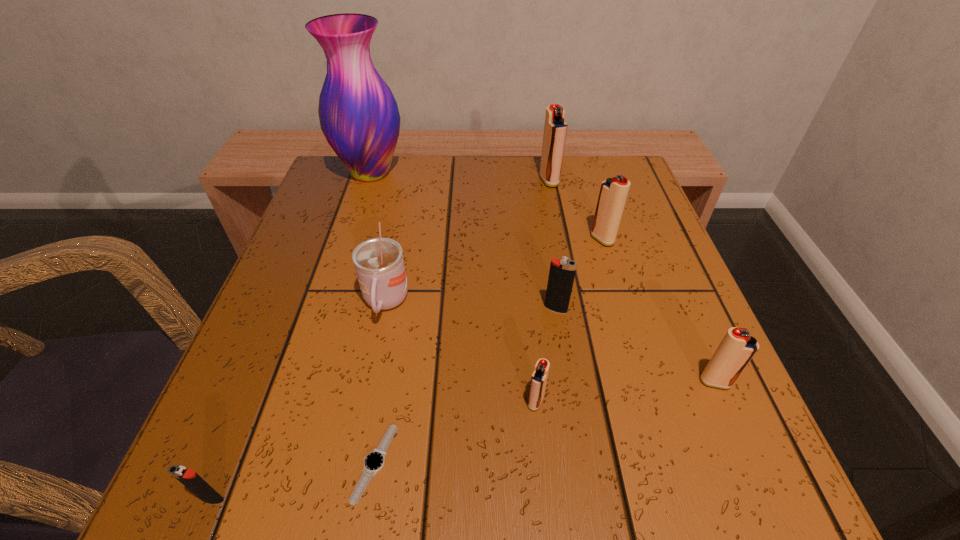
The width and height of the screenshot is (960, 540). I want to click on empty space between the fifth object from right to left and the watch, so click(455, 433).

Where is `free space between the fifth igniter from left to right and the left black igniter`? The height and width of the screenshot is (540, 960). free space between the fifth igniter from left to right and the left black igniter is located at coordinates [407, 369].

Identify the location of free area in between the cup and the smaller black igniter. (299, 401).

The image size is (960, 540). In order to click on unoccupied area between the cup and the nearest igniter in this screenshot , I will do `click(299, 401)`.

The image size is (960, 540). Identify the location of free area in between the watch and the fourth nearest igniter. (466, 386).

You are a GUI agent. You are given a task and a screenshot of the screen. Output one action in this format:
    pyautogui.click(x=<x>, y=<y>)
    Task: Click on the vacant space that is in between the bigger black igniter and the rightmost red igniter
    
    Given the screenshot: What is the action you would take?
    pyautogui.click(x=636, y=346)

Where is `free space between the leftmost igniter and the bigger black igniter`? free space between the leftmost igniter and the bigger black igniter is located at coordinates (384, 404).

You are a GUI agent. You are given a task and a screenshot of the screen. Output one action in this format:
    pyautogui.click(x=<x>, y=<y>)
    Task: Click on the empty space between the bigger black igniter and the cup
    Image resolution: width=960 pixels, height=540 pixels.
    Given the screenshot: What is the action you would take?
    pyautogui.click(x=470, y=306)

What are the coordinates of `vacant space in between the smaller black igniter and the shortest object` in the screenshot? It's located at (294, 481).

The image size is (960, 540). I want to click on free spot between the tallest igniter and the purple vase, so (x=460, y=177).